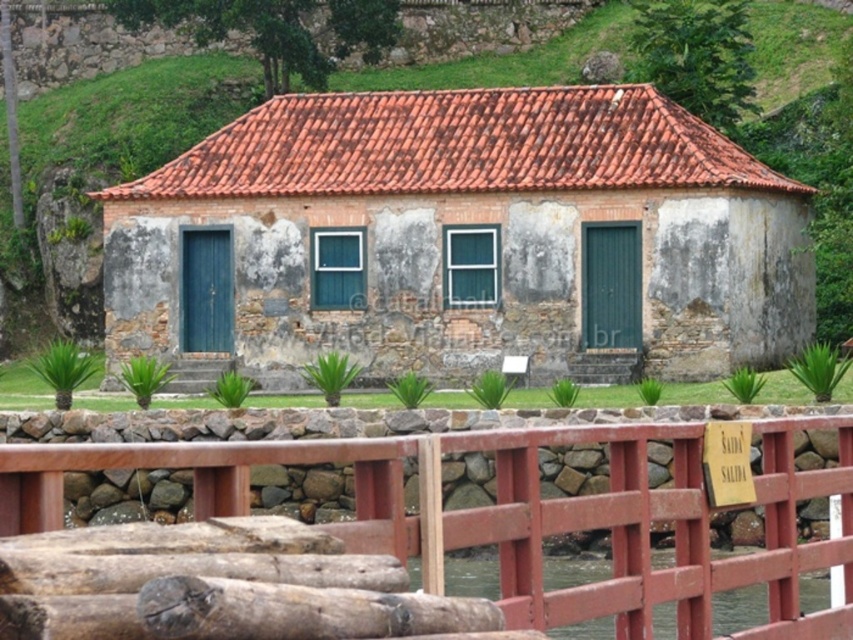
Is stone textured hut at center smaller than wooden fence at lower center?

Incorrect, stone textured hut at center is not smaller in size than wooden fence at lower center.

Is point (274, 125) positioned before point (672, 474)?

No, (274, 125) is further to viewer.

Is point (650, 115) farther from viewer compared to point (33, 490)?

Yes, it is behind point (33, 490).

The image size is (853, 640). I want to click on stone textured hut at center, so click(x=462, y=237).